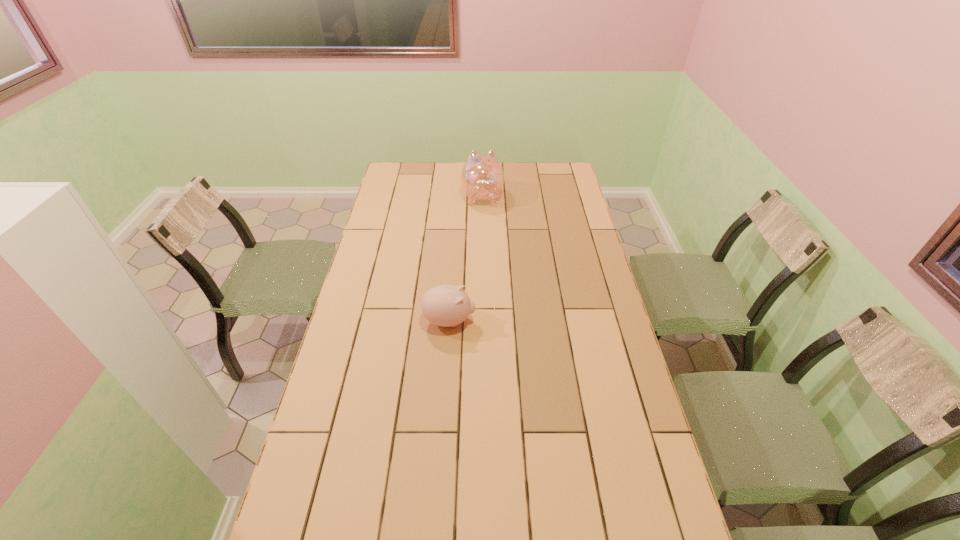
I want to click on blank area at the left edge, so click(x=409, y=189).

The height and width of the screenshot is (540, 960). Find the location of `free space at the right edge`. free space at the right edge is located at coordinates (586, 218).

The height and width of the screenshot is (540, 960). I want to click on vacant area that lies between the nearer object and the taller piggy bank, so click(x=466, y=259).

Locate an element on the screen. Image resolution: width=960 pixels, height=540 pixels. vacant point located between the taller piggy bank and the nearer piggy bank is located at coordinates (466, 259).

Find the location of `vacant space that is in between the nearer object and the taller piggy bank`. vacant space that is in between the nearer object and the taller piggy bank is located at coordinates (466, 259).

I want to click on unoccupied position between the taller object and the nearer piggy bank, so click(466, 259).